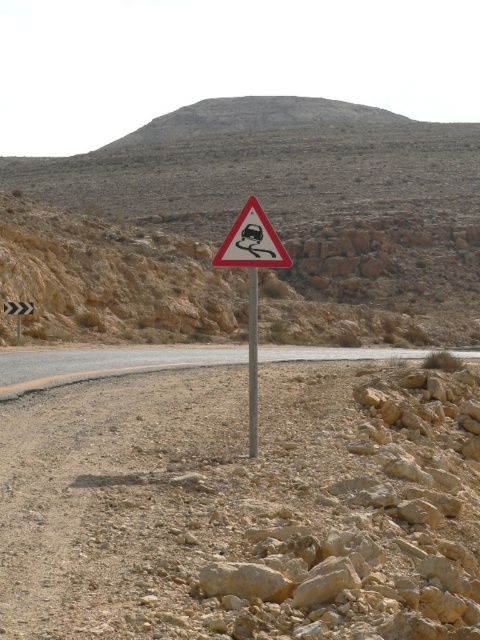
Question: Considering the real-world distances, which object is closest to the gray asphalt road at center?

Choices:
 (A) metallic triangular sign at center
 (B) metallic reflective arrow at left
 (C) white plastic triangle at center
 (D) metallic pole at center

Answer: (B)

Question: Estimate the real-world distances between objects in this image. Which object is closer to the dirt road at center?

Choices:
 (A) gray asphalt road at center
 (B) metallic triangular sign at center
 (C) white plastic triangle at center
 (D) metallic reflective arrow at left

Answer: (B)

Question: Does gray asphalt road at center appear on the left side of metallic reflective arrow at left?

Choices:
 (A) no
 (B) yes

Answer: (A)

Question: Can you confirm if white plastic triangle at center is bigger than metallic pole at center?

Choices:
 (A) no
 (B) yes

Answer: (B)

Question: Estimate the real-world distances between objects in this image. Which object is closer to the metallic pole at center?

Choices:
 (A) metallic triangular sign at center
 (B) white plastic triangle at center

Answer: (A)

Question: Can you confirm if dirt road at center is smaller than metallic triangular sign at center?

Choices:
 (A) no
 (B) yes

Answer: (A)